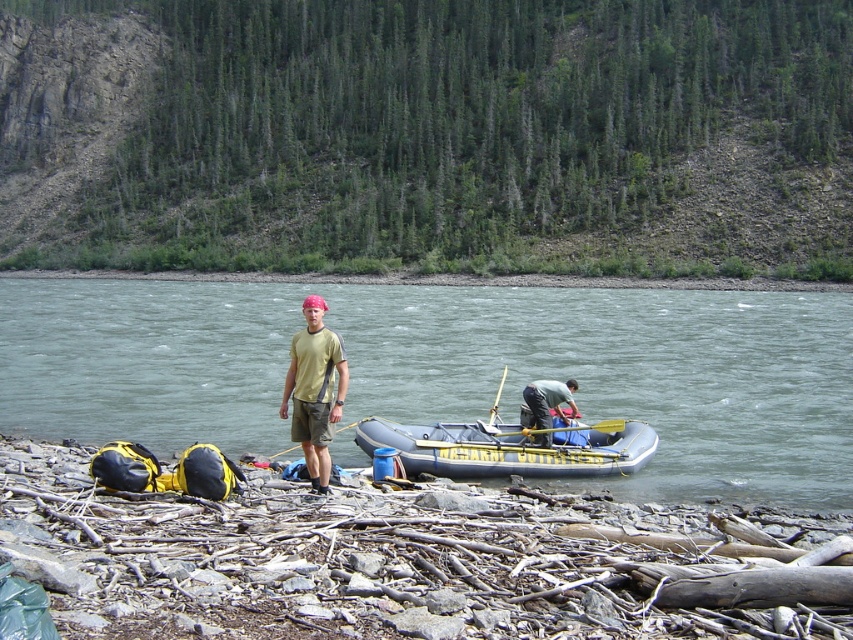
You are standing at the riverbank and want to reach the two points marked in the image. Which point, point (x=558, y=464) or point (x=329, y=358), is closer to you?

Point (x=558, y=464) is closer to you because it is further to the camera than point (x=329, y=358).